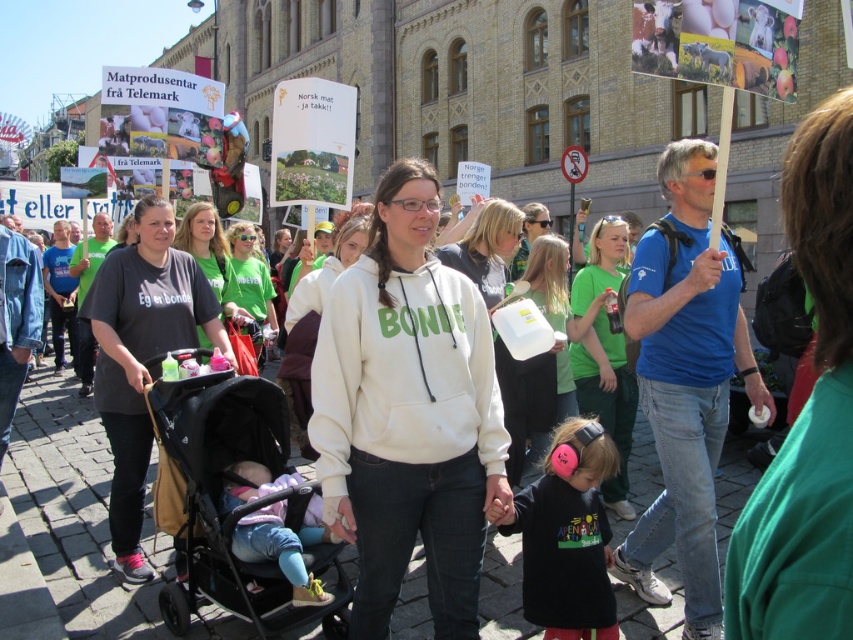
Is black fabric stroller at center-left smaller than light pink fabric at lower center?

Incorrect, black fabric stroller at center-left is not smaller in size than light pink fabric at lower center.

Image resolution: width=853 pixels, height=640 pixels. I want to click on black fabric stroller at center-left, so click(238, 504).

This screenshot has width=853, height=640. What are the coordinates of `black fabric stroller at center-left` in the screenshot? It's located at (238, 504).

Is black fabric stroller at center-left taller than green cotton t-shirt at center?

Correct, black fabric stroller at center-left is much taller as green cotton t-shirt at center.

Which is below, black fabric stroller at center-left or green cotton t-shirt at center?

black fabric stroller at center-left is below.

I want to click on black fabric stroller at center-left, so click(238, 504).

Where is `black fabric stroller at center-left`? black fabric stroller at center-left is located at coordinates (238, 504).

Based on the photo, between black matte t-shirt at lower center and green cotton shirt at center, which one has less height?

Standing shorter between the two is black matte t-shirt at lower center.

Who is higher up, black matte t-shirt at lower center or green cotton shirt at center?

green cotton shirt at center is higher up.

What do you see at coordinates (566, 536) in the screenshot?
I see `black matte t-shirt at lower center` at bounding box center [566, 536].

At what (x,y) coordinates should I click in order to perform the action: click on black matte t-shirt at lower center. Please return your answer as a coordinate pair (x, y). This screenshot has width=853, height=640. Looking at the image, I should click on click(x=566, y=536).